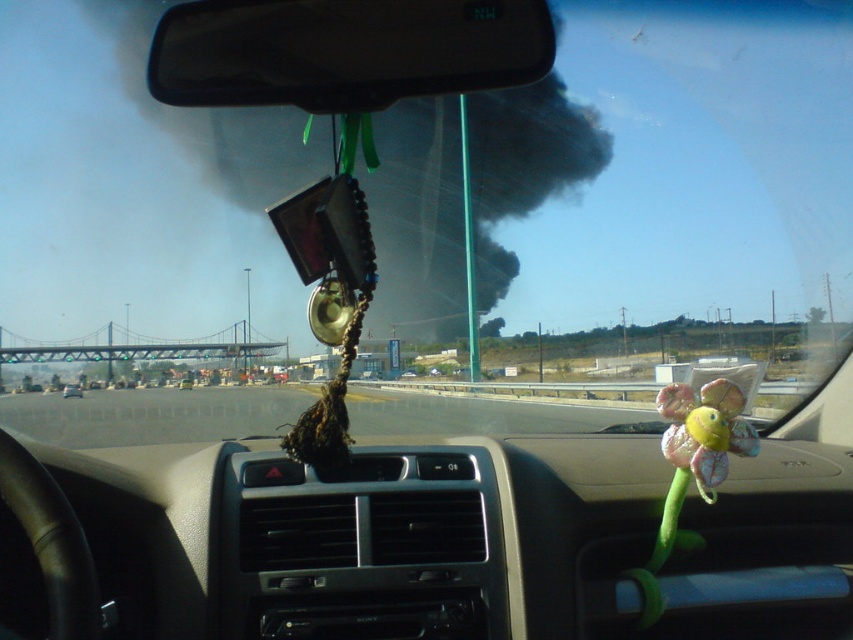
Question: Which point appears farthest from the camera in this image?

Choices:
 (A) (741, 456)
 (B) (80, 394)
 (C) (241, 19)
 (D) (258, 429)

Answer: (B)

Question: Is multicolored fabric flower at center wider than metallic silver car at center?

Choices:
 (A) no
 (B) yes

Answer: (A)

Question: Is black plastic view mirror at upper center bigger than multicolored fabric flower at center?

Choices:
 (A) no
 (B) yes

Answer: (A)

Question: Which of the following is the closest to the observer?

Choices:
 (A) (173, 129)
 (B) (200, 49)
 (C) (78, 390)
 (D) (531, 429)

Answer: (B)

Question: Which point is closer to the camera?

Choices:
 (A) (306, 38)
 (B) (672, 416)
 (C) (119, 428)
 (D) (419, 172)

Answer: (A)

Question: Can you confirm if black plastic view mirror at upper center is positioned to the right of metallic silver car at center?

Choices:
 (A) no
 (B) yes

Answer: (B)